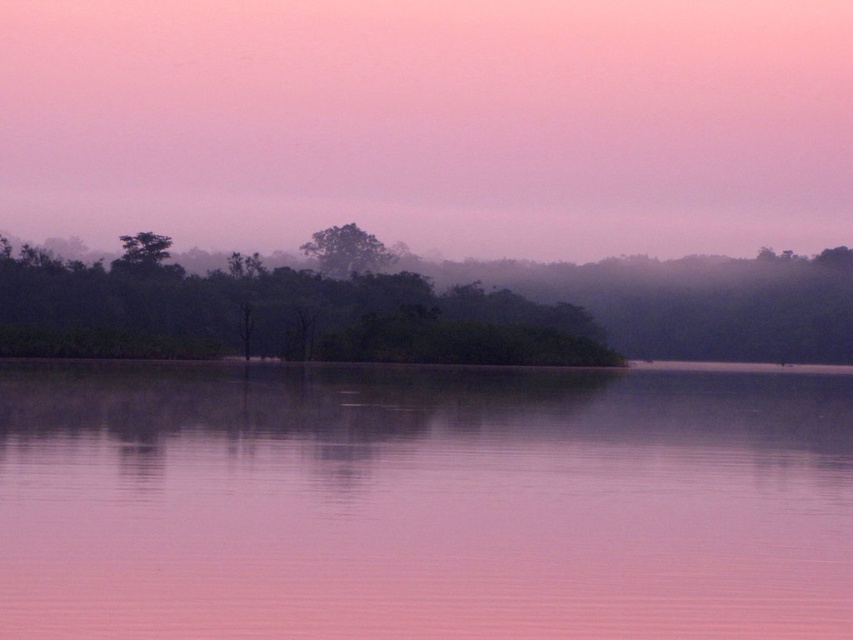
You are an artist trying to paint this landscape. You want to ensure the misty purple sky at upper center and the green matte island at center are proportionally accurate. Which object should you paint first to maintain the correct size relationship between them?

You should paint the misty purple sky at upper center first because it is larger in size than the green matte island at center, ensuring the correct proportion between them.

You are standing at the edge of the serene landscape scene. There is a point marked at coordinates (422, 502). What object in the scene is located at this point?

The point at coordinates (422, 502) corresponds to the pink smooth water at center.

You are standing at the edge of the water and want to take a photo of both the misty purple sky at upper center and the green matte tree at center. If your camera can focus on objects up to 100 feet away, will it be able to capture both subjects clearly in the same shot?

The distance between the misty purple sky at upper center and the green matte tree at center is 95.24 feet. Since your camera can focus up to 100 feet, it should be able to capture both subjects clearly as the distance is within the camera range.